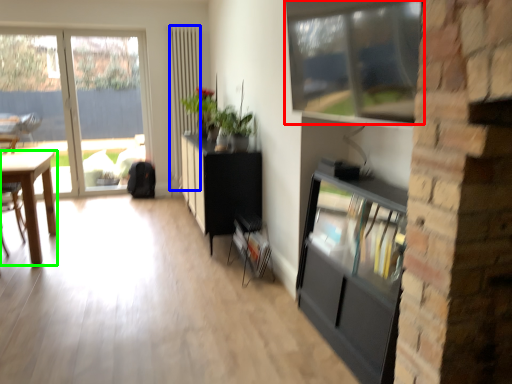
Question: Considering the real-world distances, which object is closest to window (highlighted by a red box)? screen door (highlighted by a blue box) or desk (highlighted by a green box).

Choices:
 (A) screen door
 (B) desk

Answer: (B)